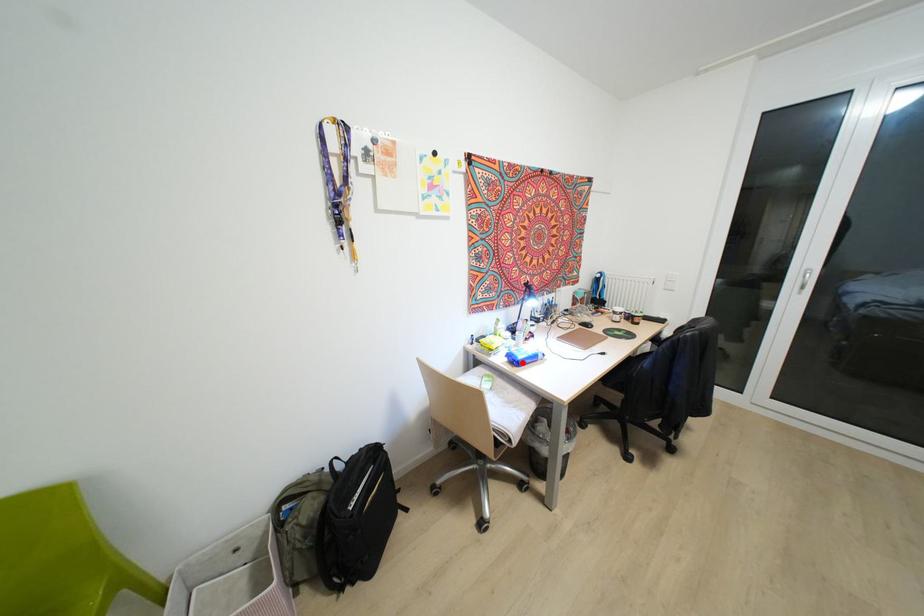
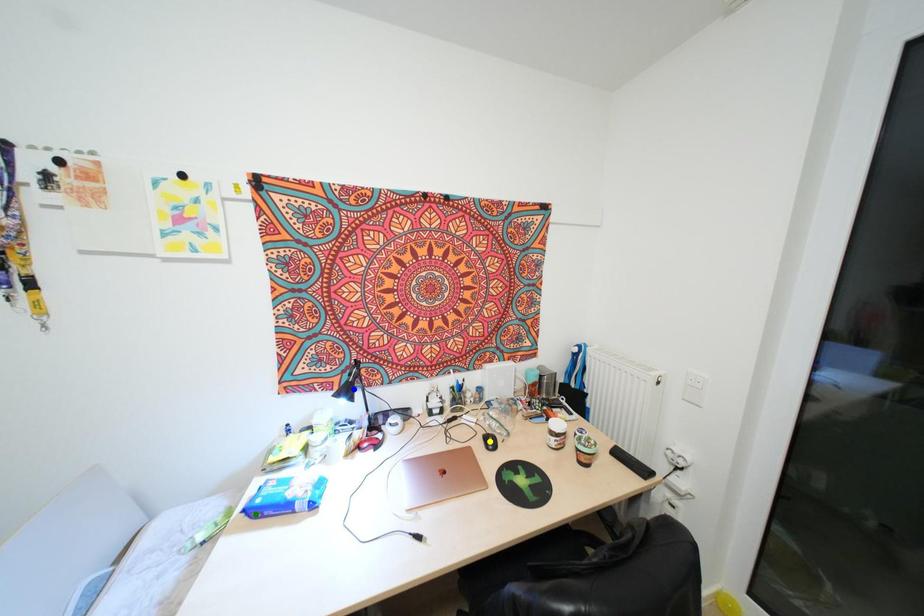
Question: I am providing you with two images of the same scene from different viewpoints. A red point is marked on the first image. You are given multiple points on the second image. Which point in image 2 is actually the same real-world point as the red point in image 1?

Choices:
 (A) blue point
 (B) green point
 (C) yellow point

Answer: (B)